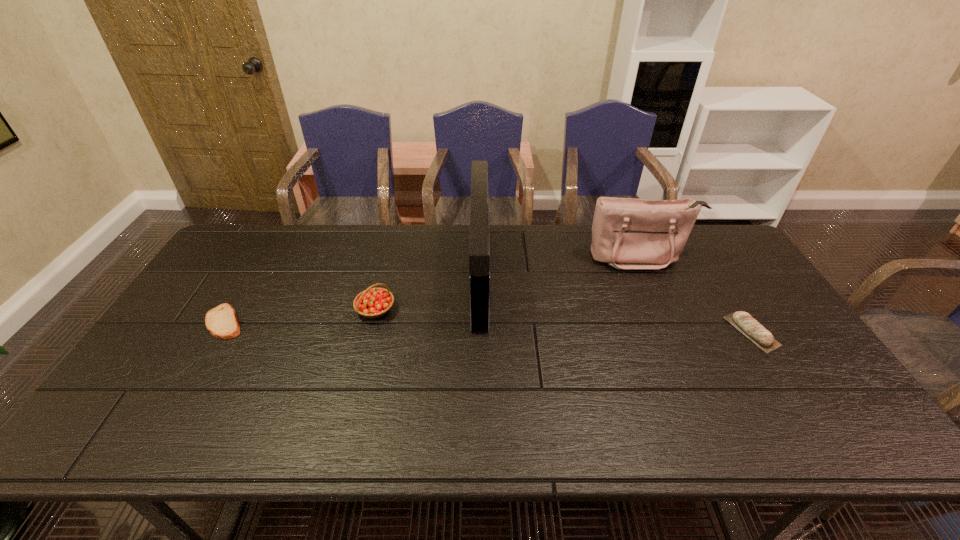
Where is `pita bread located at the right edge`? pita bread located at the right edge is located at coordinates (744, 322).

Where is `object located at the far right corner`? The image size is (960, 540). object located at the far right corner is located at coordinates (627, 233).

You are a GUI agent. You are given a task and a screenshot of the screen. Output one action in this format:
    pyautogui.click(x=<x>, y=<y>)
    Task: Click on the blank space at the far edge
    The height and width of the screenshot is (540, 960).
    Given the screenshot: What is the action you would take?
    pyautogui.click(x=273, y=258)

In the image, there is a desktop. Identify the location of vacant region at the near edge. This screenshot has width=960, height=540. (307, 426).

At what (x,y) coordinates should I click in order to perform the action: click on vacant space at the left edge of the desktop. Please return your answer as a coordinate pair (x, y). The height and width of the screenshot is (540, 960). Looking at the image, I should click on (176, 337).

This screenshot has width=960, height=540. In the image, there is a desktop. Identify the location of blank space at the right edge. (812, 401).

I want to click on vacant space at the far left corner of the desktop, so click(233, 238).

The height and width of the screenshot is (540, 960). In the image, there is a desktop. What are the coordinates of `free space at the near right corner` in the screenshot? It's located at (870, 438).

Locate an element on the screen. The width and height of the screenshot is (960, 540). free space between the tallest object and the right pita bread is located at coordinates (615, 303).

Find the location of a particular element. This screenshot has width=960, height=540. blank region between the videotape and the shoulder bag is located at coordinates (560, 266).